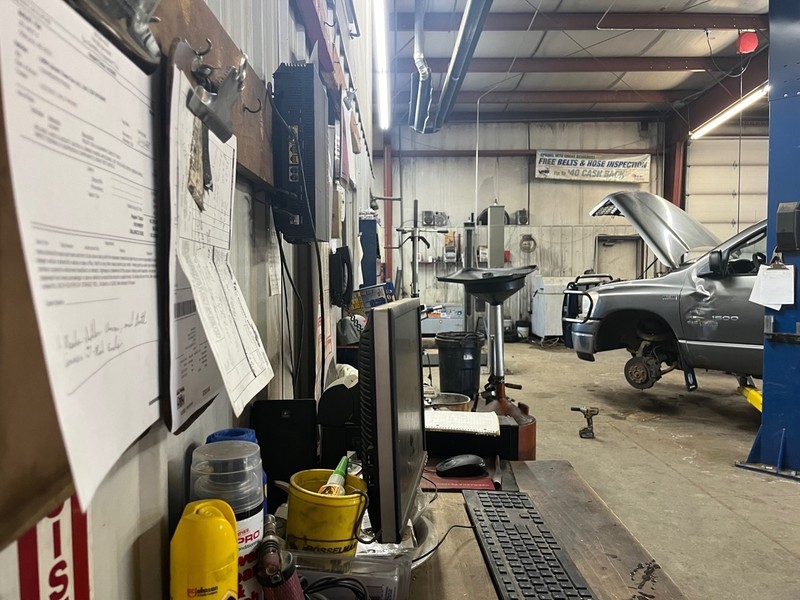
Locate an element on the screen. This screenshot has width=800, height=600. light is located at coordinates (364, 55).